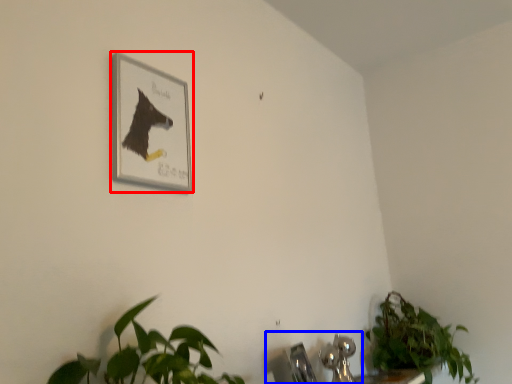
Question: Which object appears closest to the camera in this image, picture frame (highlighted by a red box) or sink (highlighted by a blue box)?

Choices:
 (A) picture frame
 (B) sink

Answer: (A)